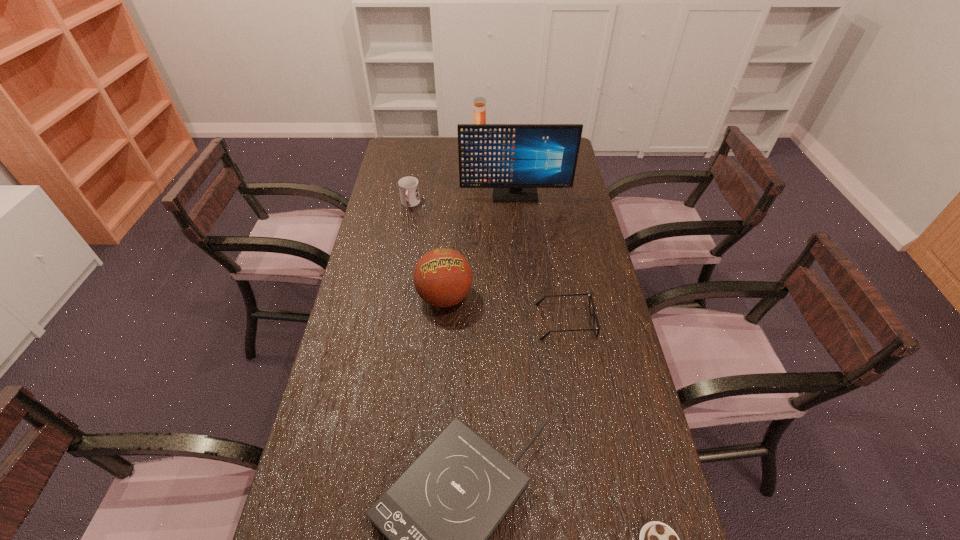
You are a GUI agent. You are given a task and a screenshot of the screen. Output one action in this format:
    pyautogui.click(x=<x>, y=<y>)
    Task: Click on the vacant space situated with the lenses facing outward on the spectacles
    
    Given the screenshot: What is the action you would take?
    pyautogui.click(x=498, y=322)

Where is `vacant region located 0.130m with the lenses facing outward on the spectacles`? This screenshot has height=540, width=960. vacant region located 0.130m with the lenses facing outward on the spectacles is located at coordinates (495, 322).

What are the coordinates of `free region located 0.200m with the lenses facing outward on the spectacles` in the screenshot? It's located at (472, 322).

Find the location of a particular element. The image size is (960, 540). object present at the far edge is located at coordinates [x=479, y=102].

Locate an element on the screen. The image size is (960, 540). object present at the left edge is located at coordinates (408, 186).

Where is `computer monitor that is positioned at the right edge`? The height and width of the screenshot is (540, 960). computer monitor that is positioned at the right edge is located at coordinates (514, 159).

Locate an element on the screen. This screenshot has height=540, width=960. spectacles present at the right edge is located at coordinates [593, 315].

Find the location of `free region at the left edge of the desktop`. free region at the left edge of the desktop is located at coordinates (366, 276).

At what (x,y) coordinates should I click in order to perform the action: click on vacant space at the right edge of the desktop. Please return your answer as a coordinate pair (x, y). Looking at the image, I should click on (585, 212).

I want to click on vacant space that's between the third tallest object and the cup, so click(427, 251).